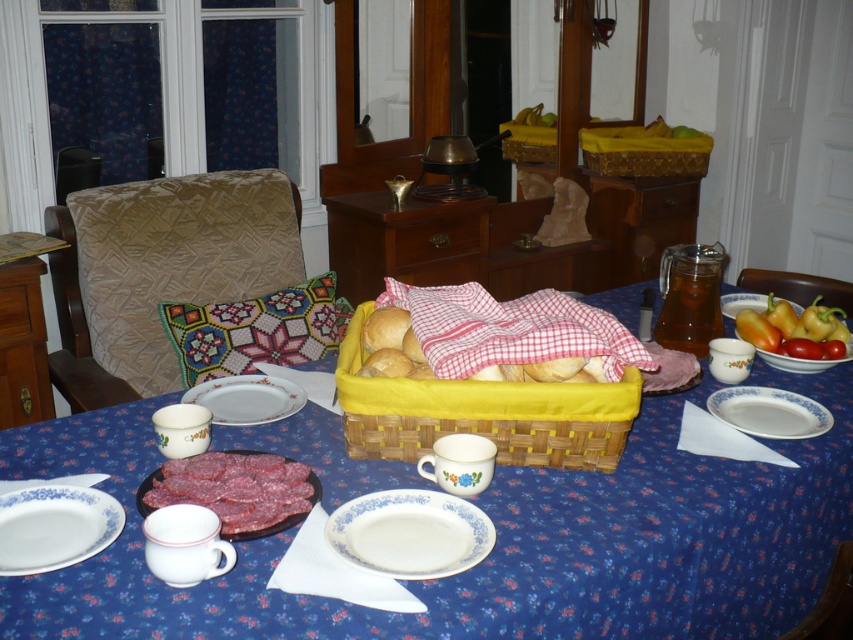
Between point (434, 630) and point (312, 472), which one is positioned behind?

The point (312, 472) is more distant.

You are a GUI agent. You are given a task and a screenshot of the screen. Output one action in this format:
    pyautogui.click(x=<x>, y=<y>)
    Task: Click on the blue floral tablecloth at center
    This screenshot has height=640, width=853.
    Given the screenshot: What is the action you would take?
    pyautogui.click(x=496, y=541)

Where is `blue floral tablecloth at center`? blue floral tablecloth at center is located at coordinates tap(496, 541).

Can you confirm if yellow wicker basket at center is thinner than sliced salami at center?

Incorrect, yellow wicker basket at center's width is not less than sliced salami at center's.

Who is lower down, yellow wicker basket at center or sliced salami at center?

sliced salami at center is lower down.

Does point (352, 390) come closer to viewer compared to point (310, 484)?

That is False.

The image size is (853, 640). In order to click on yellow wicker basket at center in this screenshot , I will do `click(483, 413)`.

Does point (28, 522) come closer to viewer compared to point (248, 410)?

Yes, it is.

Does point (64, 486) come farther from viewer compared to point (270, 406)?

No, it is not.

Is point (48, 540) positioned behind point (305, 400)?

That is False.

The image size is (853, 640). Find the location of `white ceramic plate at lower left`. white ceramic plate at lower left is located at coordinates (54, 525).